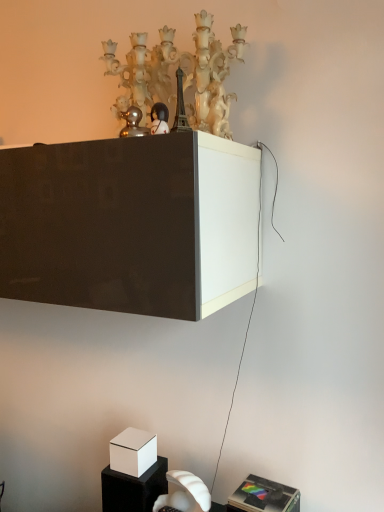
Where is `white matte cube at lower left, which is counted as the first furniture, starting from the back`? The height and width of the screenshot is (512, 384). white matte cube at lower left, which is counted as the first furniture, starting from the back is located at coordinates (133, 488).

Identify the location of metallic silver speaker at lower right, the 1th furniture when ordered from front to back. (264, 496).

The width and height of the screenshot is (384, 512). Describe the element at coordinates (159, 119) in the screenshot. I see `matte black figurine at upper center` at that location.

Describe the element at coordinates (133, 451) in the screenshot. This screenshot has height=512, width=384. I see `white matte box at lower left` at that location.

Where is `matte white chandelier at upper center`? matte white chandelier at upper center is located at coordinates (181, 70).

From the picture: Is matte white chandelier at upper center with metallic silver speaker at lower right, which appears as the second furniture when viewed from the left?

No, matte white chandelier at upper center is not in contact with metallic silver speaker at lower right, which appears as the second furniture when viewed from the left.

How much distance is there between matte white chandelier at upper center and metallic silver speaker at lower right, positioned as the 1th furniture in right-to-left order?

A distance of 1.08 meters exists between matte white chandelier at upper center and metallic silver speaker at lower right, positioned as the 1th furniture in right-to-left order.

From the picture: Is matte white chandelier at upper center aimed at metallic silver speaker at lower right, positioned as the 1th furniture in right-to-left order?

No, matte white chandelier at upper center does not turn towards metallic silver speaker at lower right, positioned as the 1th furniture in right-to-left order.

Considering the relative sizes of matte white chandelier at upper center and white matte cube at lower left, which is the first furniture from left to right, in the image provided, is matte white chandelier at upper center taller than white matte cube at lower left, which is the first furniture from left to right,?

Yes, matte white chandelier at upper center is taller than white matte cube at lower left, which is the first furniture from left to right.

How much distance is there between matte white chandelier at upper center and white matte cube at lower left, which is the first furniture from left to right?

The distance of matte white chandelier at upper center from white matte cube at lower left, which is the first furniture from left to right, is 1.09 meters.

Is matte white chandelier at upper center aimed at white matte cube at lower left, which is the first furniture from left to right?

No.

Considering the positions of objects matte white chandelier at upper center and white matte cube at lower left, placed as the second furniture when sorted from front to back, in the image provided, who is more to the right, matte white chandelier at upper center or white matte cube at lower left, placed as the second furniture when sorted from front to back,?

matte white chandelier at upper center is more to the right.

Are white matte box at lower left and metallic silver speaker at lower right, acting as the 2th furniture starting from the back, beside each other?

No, white matte box at lower left is not with metallic silver speaker at lower right, acting as the 2th furniture starting from the back.

Does point (132, 439) lie in front of point (272, 507)?

No.

From a real-world perspective, is white matte box at lower left positioned under metallic silver speaker at lower right, acting as the 2th furniture starting from the back, based on gravity?

No, from a real-world perspective, white matte box at lower left is not below metallic silver speaker at lower right, acting as the 2th furniture starting from the back.

Considering the relative sizes of white matte box at lower left and metallic silver speaker at lower right, which appears as the second furniture when viewed from the left, in the image provided, is white matte box at lower left smaller than metallic silver speaker at lower right, which appears as the second furniture when viewed from the left,?

Yes.

Could you tell me if metallic silver speaker at lower right, the 1th furniture when ordered from front to back, is facing white matte cube at lower left, which is the first furniture from left to right?

No, metallic silver speaker at lower right, the 1th furniture when ordered from front to back, is not aimed at white matte cube at lower left, which is the first furniture from left to right.

Which is closer, [252,509] or [157,478]?

Point [252,509]

The width and height of the screenshot is (384, 512). Identify the location of furniture below the metallic silver speaker at lower right, which appears as the second furniture when viewed from the left (from a real-world perspective). (133, 488).

Is metallic silver speaker at lower right, which appears as the second furniture when viewed from the left, directly adjacent to white matte cube at lower left, which is counted as the first furniture, starting from the back?

No, metallic silver speaker at lower right, which appears as the second furniture when viewed from the left, is not in contact with white matte cube at lower left, which is counted as the first furniture, starting from the back.

From the image's perspective, which is below, white matte cube at lower left, placed as the second furniture when sorted from front to back, or metallic silver speaker at lower right, the 1th furniture when ordered from front to back?

From the image's view, metallic silver speaker at lower right, the 1th furniture when ordered from front to back, is below.

Is white matte cube at lower left, which is the first furniture from left to right, positioned with its back to metallic silver speaker at lower right, positioned as the 1th furniture in right-to-left order?

No, metallic silver speaker at lower right, positioned as the 1th furniture in right-to-left order, is not at the back of white matte cube at lower left, which is the first furniture from left to right.

Which object is wider, white matte cube at lower left, placed as the second furniture when sorted from front to back, or metallic silver speaker at lower right, the 1th furniture when ordered from front to back?

With larger width is metallic silver speaker at lower right, the 1th furniture when ordered from front to back.

Is white matte cube at lower left, which is counted as the first furniture, starting from the back, far from metallic silver speaker at lower right, the 1th furniture when ordered from front to back?

white matte cube at lower left, which is counted as the first furniture, starting from the back, is actually quite close to metallic silver speaker at lower right, the 1th furniture when ordered from front to back.

Is white matte box at lower left bigger or smaller than white matte cube at lower left, which is counted as the first furniture, starting from the back?

white matte box at lower left is smaller than white matte cube at lower left, which is counted as the first furniture, starting from the back.

Can we say white matte box at lower left lies outside white matte cube at lower left, placed as the second furniture when sorted from front to back?

white matte box at lower left lies outside white matte cube at lower left, placed as the second furniture when sorted from front to back,'s area.

Is white matte box at lower left wider than white matte cube at lower left, which is the first furniture from left to right?

In fact, white matte box at lower left might be narrower than white matte cube at lower left, which is the first furniture from left to right.

Can you confirm if white matte box at lower left is positioned to the right of white matte cube at lower left, which is the first furniture from left to right?

In fact, white matte box at lower left is to the left of white matte cube at lower left, which is the first furniture from left to right.

Is matte black figurine at upper center aimed at matte white chandelier at upper center?

No, matte black figurine at upper center is not turned towards matte white chandelier at upper center.

Is matte black figurine at upper center spatially inside matte white chandelier at upper center, or outside of it?

The correct answer is: outside.

Which object is positioned more to the right, matte black figurine at upper center or matte white chandelier at upper center?

matte white chandelier at upper center.

Is matte black figurine at upper center smaller than matte white chandelier at upper center?

Indeed, matte black figurine at upper center has a smaller size compared to matte white chandelier at upper center.

At what (x,y) coordinates should I click in order to perform the action: click on the 1st furniture below the matte white chandelier at upper center (from a real-world perspective). Please return your answer as a coordinate pair (x, y). Looking at the image, I should click on (264, 496).

In order to click on the 2nd furniture behind the matte white chandelier at upper center in this screenshot , I will do coord(133,488).

Considering their positions, is white matte box at lower left positioned further to matte white chandelier at upper center than matte black figurine at upper center?

Based on the image, white matte box at lower left appears to be further to matte white chandelier at upper center.

From the image, which object appears to be farther from matte white chandelier at upper center, white matte cube at lower left, the second furniture when ordered from right to left, or white matte box at lower left?

Based on the image, white matte cube at lower left, the second furniture when ordered from right to left, appears to be further to matte white chandelier at upper center.

Which object lies nearer to the anchor point metallic silver speaker at lower right, positioned as the 1th furniture in right-to-left order, matte black figurine at upper center or white matte cube at lower left, placed as the second furniture when sorted from front to back?

Among the two, white matte cube at lower left, placed as the second furniture when sorted from front to back, is located nearer to metallic silver speaker at lower right, positioned as the 1th furniture in right-to-left order.

From the image, which object appears to be nearer to matte white chandelier at upper center, metallic silver speaker at lower right, acting as the 2th furniture starting from the back, or matte black figurine at upper center?

matte black figurine at upper center lies closer to matte white chandelier at upper center than the other object.

Based on their spatial positions, is white matte cube at lower left, the second furniture when ordered from right to left, or metallic silver speaker at lower right, the 1th furniture when ordered from front to back, closer to white matte box at lower left?

Based on the image, white matte cube at lower left, the second furniture when ordered from right to left, appears to be nearer to white matte box at lower left.

When comparing their distances from white matte box at lower left, does white matte cube at lower left, the second furniture when ordered from right to left, or matte white chandelier at upper center seem closer?

white matte cube at lower left, the second furniture when ordered from right to left.

In the scene shown: Based on their spatial positions, is white matte box at lower left or white matte cube at lower left, placed as the second furniture when sorted from front to back, closer to matte black figurine at upper center?

white matte box at lower left.

Based on their spatial positions, is matte white chandelier at upper center or metallic silver speaker at lower right, the 1th furniture when ordered from front to back, closer to matte black figurine at upper center?

matte white chandelier at upper center is closer to matte black figurine at upper center.

Where is `furniture that lies between matte black figurine at upper center and metallic silver speaker at lower right, positioned as the 1th furniture in right-to-left order, from top to bottom`? This screenshot has height=512, width=384. furniture that lies between matte black figurine at upper center and metallic silver speaker at lower right, positioned as the 1th furniture in right-to-left order, from top to bottom is located at coordinates (133, 488).

Identify the location of toy between matte white chandelier at upper center and white matte box at lower left vertically. (159, 119).

Locate an element on the screen. toy between matte white chandelier at upper center and white matte cube at lower left, which is the first furniture from left to right, vertically is located at coordinates (159, 119).

You are a GUI agent. You are given a task and a screenshot of the screen. Output one action in this format:
    pyautogui.click(x=<x>, y=<y>)
    Task: Click on the box between matte white chandelier at upper center and metallic silver speaker at lower right, which appears as the second furniture when viewed from the left, vertically
    The height and width of the screenshot is (512, 384).
    Given the screenshot: What is the action you would take?
    pyautogui.click(x=133, y=451)